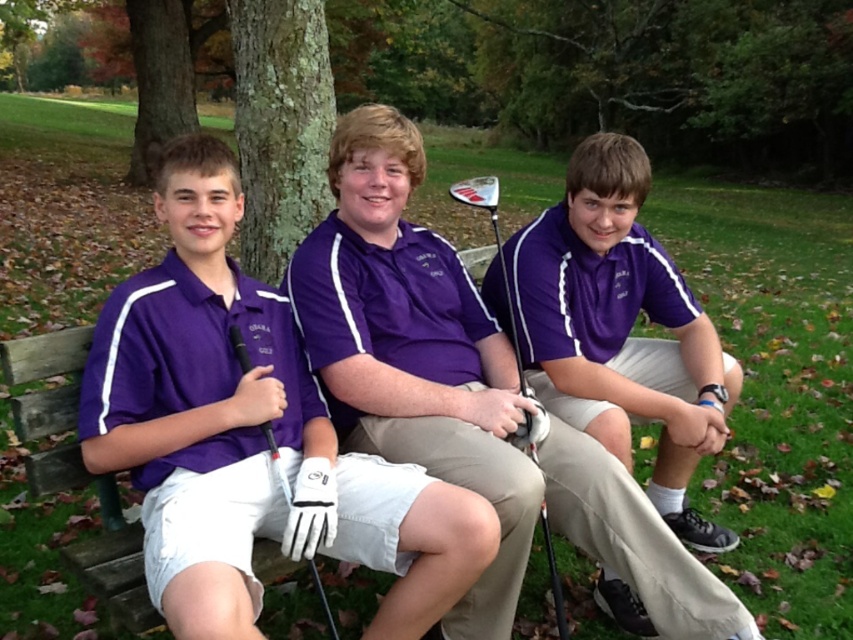
Between point (669, 461) and point (491, 176), which one is positioned behind?

The point (491, 176) is more distant.

Who is positioned more to the right, purple cotton polo shirt at center or matte white golf club at center?

purple cotton polo shirt at center

Image resolution: width=853 pixels, height=640 pixels. What do you see at coordinates (619, 330) in the screenshot? I see `purple cotton polo shirt at center` at bounding box center [619, 330].

At what (x,y) coordinates should I click in order to perform the action: click on purple cotton polo shirt at center. Please return your answer as a coordinate pair (x, y). The image size is (853, 640). Looking at the image, I should click on (619, 330).

Does purple matte golf club at center have a smaller size compared to purple cotton polo shirt at center?

Actually, purple matte golf club at center might be larger than purple cotton polo shirt at center.

This screenshot has width=853, height=640. I want to click on purple matte golf club at center, so click(x=466, y=394).

Where is `purple matte golf club at center`? purple matte golf club at center is located at coordinates (466, 394).

Can you confirm if purple matte golf club at center is positioned to the left of matte white golf club at center?

Yes, purple matte golf club at center is to the left of matte white golf club at center.

Can you confirm if purple matte golf club at center is positioned above matte white golf club at center?

Actually, purple matte golf club at center is below matte white golf club at center.

Between point (450, 362) and point (511, 308), which one is positioned behind?

Positioned behind is point (511, 308).

Image resolution: width=853 pixels, height=640 pixels. I want to click on purple matte golf club at center, so (x=466, y=394).